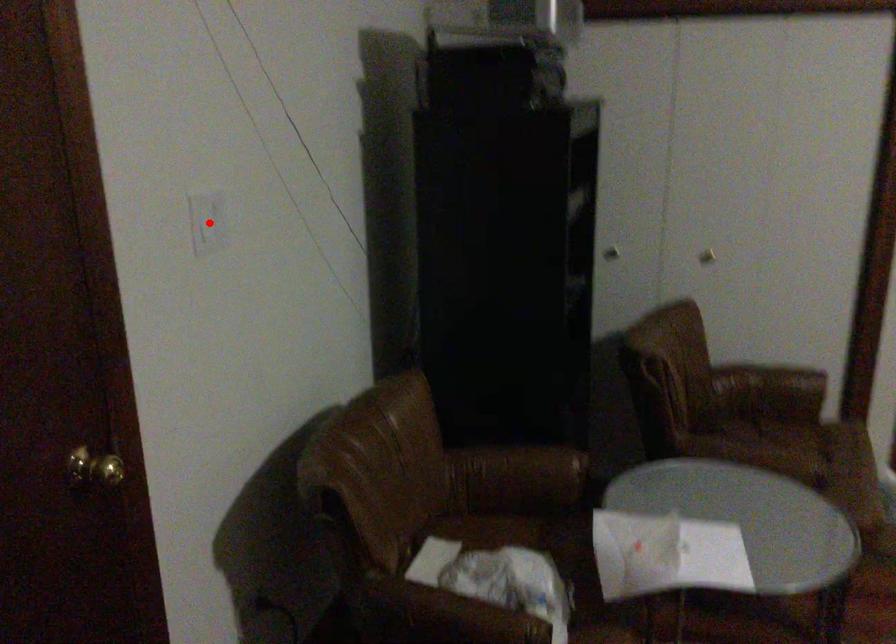
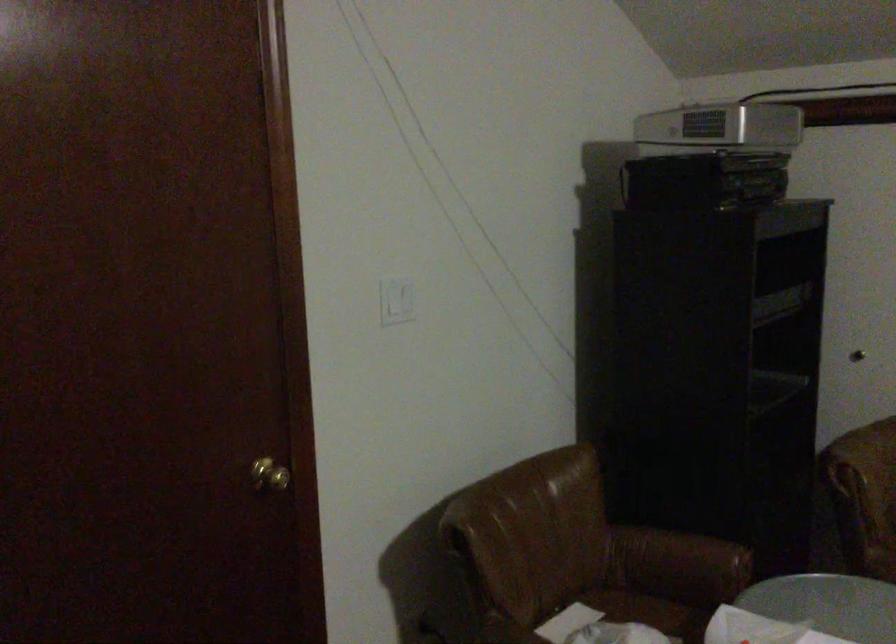
Question: I am providing you with two images of the same scene from different viewpoints. Image1 has a red point marked. In image2, the corresponding 3D location appears at what relative position? Reply with the corresponding letter.

Choices:
 (A) Closer
 (B) Farther

Answer: (B)